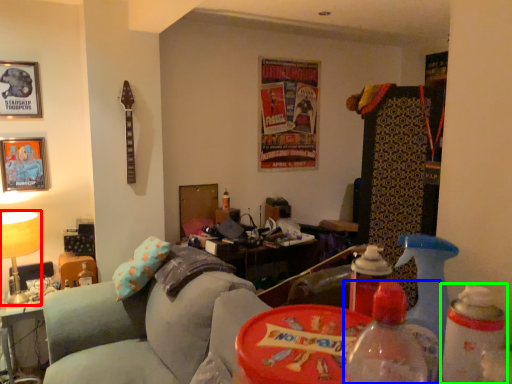
Question: Considering the real-world distances, which object is closest to table lamp (highlighted by a red box)? bottle (highlighted by a blue box) or bottle (highlighted by a green box).

Choices:
 (A) bottle
 (B) bottle

Answer: (A)